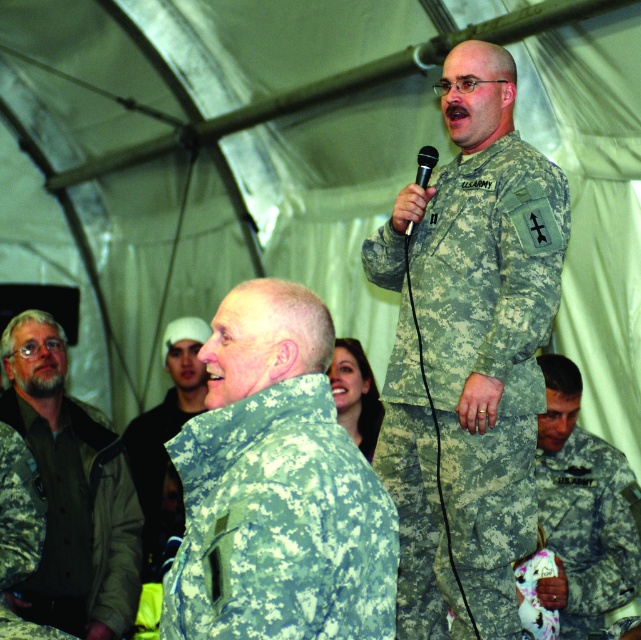
How far apart are camouflage uniform at center and black plastic microphone at upper center?

camouflage uniform at center is 8.39 feet from black plastic microphone at upper center.

Find the location of a particular element. camouflage uniform at center is located at coordinates (165, 438).

Is point (203, 397) positioned behind point (428, 172)?

Yes, point (203, 397) is farther from viewer.

This screenshot has height=640, width=641. I want to click on camouflage uniform at center, so click(x=165, y=438).

Can you confirm if camouflage fabric uniform at upper center is positioned below camouflage uniform at center?

No.

How far apart are camouflage fabric uniform at upper center and camouflage uniform at center?

Answer: 7.53 feet

Who is more forward, (406, 436) or (192, 412)?

Positioned in front is point (406, 436).

You are a GUI agent. You are given a task and a screenshot of the screen. Output one action in this format:
    pyautogui.click(x=<x>, y=<y>)
    Task: Click on the camouflage fabric uniform at upper center
    The height and width of the screenshot is (640, 641).
    Given the screenshot: What is the action you would take?
    pyautogui.click(x=488, y=349)

Based on the photo, does camouflage fabric jacket at center appear over black plastic microphone at upper center?

No.

Which is more to the right, camouflage fabric jacket at center or black plastic microphone at upper center?

black plastic microphone at upper center is more to the right.

Is point (351, 579) more distant than point (417, 182)?

No, it is in front of (417, 182).

The height and width of the screenshot is (640, 641). Identify the location of camouflage fabric jacket at center. (279, 524).